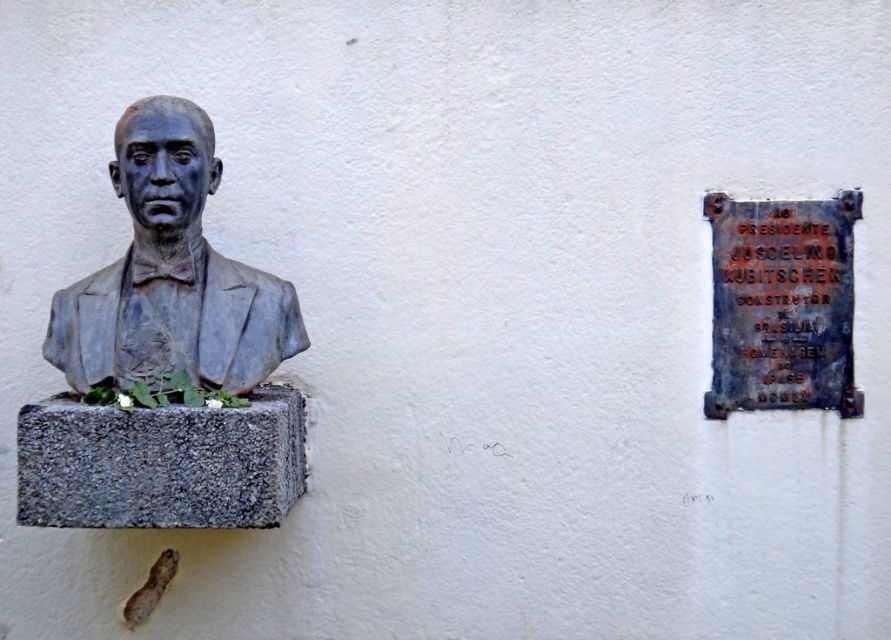
Question: Which object is the closest to the bronze plaque at right?

Choices:
 (A) white matte stone at lower left
 (B) matte bronze bust at left

Answer: (B)

Question: Is matte bronze bust at left in front of bronze plaque at right?

Choices:
 (A) no
 (B) yes

Answer: (B)

Question: Is matte bronze bust at left bigger than bronze plaque at right?

Choices:
 (A) no
 (B) yes

Answer: (B)

Question: Which of the following is the farthest from the observer?

Choices:
 (A) (170, 205)
 (B) (111, 394)
 (C) (816, 332)

Answer: (C)

Question: Estimate the real-world distances between objects in this image. Which object is closer to the matte bronze bust at left?

Choices:
 (A) bronze plaque at right
 (B) white matte stone at lower left

Answer: (B)

Question: Does matte bronze bust at left have a greater width compared to white matte stone at lower left?

Choices:
 (A) yes
 (B) no

Answer: (A)